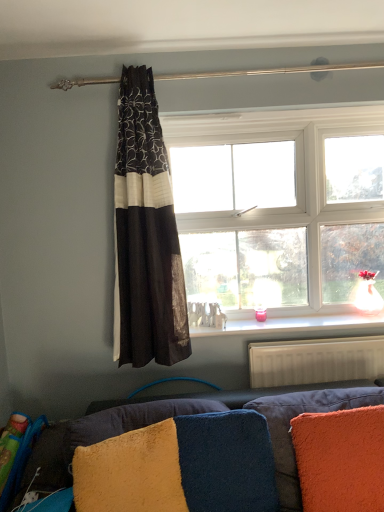
Question: In the image, is white textured radiator at lower right on the left side or the right side of white plastic window at center?

Choices:
 (A) left
 (B) right

Answer: (B)

Question: Considering their positions, is white textured radiator at lower right located in front of or behind white plastic window at center?

Choices:
 (A) front
 (B) behind

Answer: (A)

Question: Considering the real-world distances, which object is closest to the fuzzy yellow pillow at lower left, acting as the third pillow starting from the right?

Choices:
 (A) velvet blue couch at lower center
 (B) white plastic window at center
 (C) orange fuzzy pillow at lower right, which is the third pillow in left-to-right order
 (D) white textured radiator at lower right
 (E) black sheer curtain at center

Answer: (A)

Question: Based on their relative distances, which object is farther from the fluffy blue/yellow pillow at lower center, which is the second pillow from right to left?

Choices:
 (A) orange fuzzy pillow at lower right, positioned as the first pillow in right-to-left order
 (B) white plastic window at center
 (C) white textured radiator at lower right
 (D) fuzzy yellow pillow at lower left, marked as the 1th pillow in a left-to-right arrangement
 (E) velvet blue couch at lower center

Answer: (B)